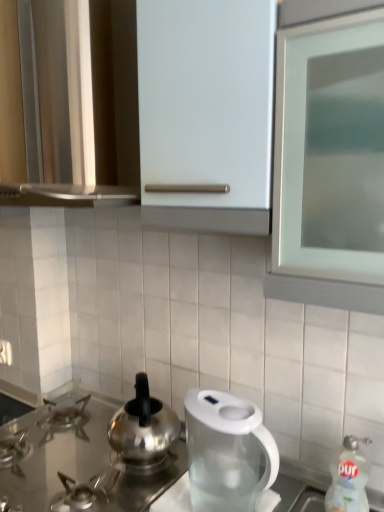
Question: Does polished stainless steel kettle at center have a lesser height compared to satin silver gas stove at lower left?

Choices:
 (A) no
 (B) yes

Answer: (A)

Question: Is there a large distance between polished stainless steel kettle at center and satin silver gas stove at lower left?

Choices:
 (A) no
 (B) yes

Answer: (A)

Question: Can you confirm if polished stainless steel kettle at center is bigger than satin silver gas stove at lower left?

Choices:
 (A) yes
 (B) no

Answer: (B)

Question: Is polished stainless steel kettle at center taller than satin silver gas stove at lower left?

Choices:
 (A) no
 (B) yes

Answer: (B)

Question: Is polished stainless steel kettle at center completely or partially outside of satin silver gas stove at lower left?

Choices:
 (A) no
 (B) yes

Answer: (B)

Question: Looking at their shapes, would you say matte white cabinet at upper center is wider or thinner than transparent plastic kettle at center?

Choices:
 (A) wide
 (B) thin

Answer: (A)

Question: In terms of height, does matte white cabinet at upper center look taller or shorter compared to transparent plastic kettle at center?

Choices:
 (A) short
 (B) tall

Answer: (B)

Question: Which is correct: matte white cabinet at upper center is inside transparent plastic kettle at center, or outside of it?

Choices:
 (A) outside
 (B) inside

Answer: (A)

Question: From the image's perspective, is matte white cabinet at upper center above or below transparent plastic kettle at center?

Choices:
 (A) below
 (B) above

Answer: (B)

Question: From a real-world perspective, relative to white glossy bottle at lower right, is satin silver gas stove at lower left vertically above or below?

Choices:
 (A) above
 (B) below

Answer: (B)

Question: Is point (61, 479) closer or farther from the camera than point (342, 442)?

Choices:
 (A) farther
 (B) closer

Answer: (A)

Question: In the image, is satin silver gas stove at lower left on the left side or the right side of white glossy bottle at lower right?

Choices:
 (A) right
 (B) left

Answer: (B)

Question: In terms of size, does satin silver gas stove at lower left appear bigger or smaller than white glossy bottle at lower right?

Choices:
 (A) small
 (B) big

Answer: (B)

Question: Would you say polished stainless steel kettle at center is inside or outside transparent plastic kettle at center?

Choices:
 (A) inside
 (B) outside

Answer: (B)

Question: Visually, is polished stainless steel kettle at center positioned to the left or to the right of transparent plastic kettle at center?

Choices:
 (A) right
 (B) left

Answer: (B)